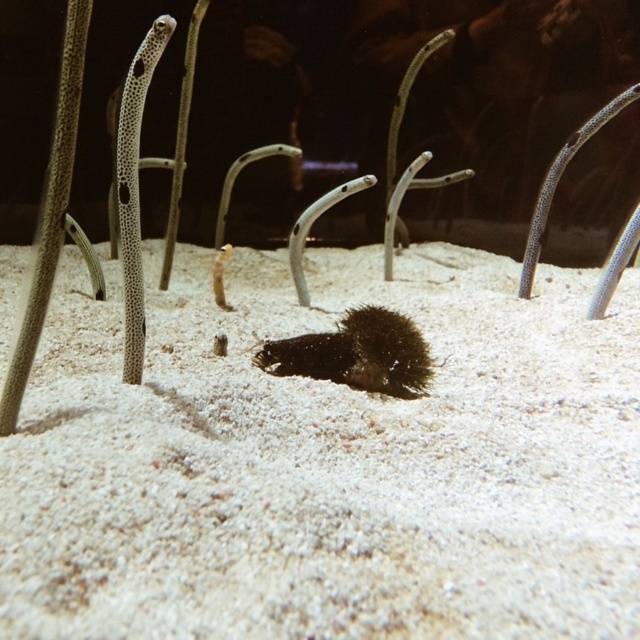
Is dark fuzzy sea urchin at center to the left of speckled skin garden eel at left from the viewer's perspective?

No, dark fuzzy sea urchin at center is not to the left of speckled skin garden eel at left.

Is point (380, 353) closer to viewer compared to point (132, 336)?

No, it is behind (132, 336).

Locate an element on the screen. dark fuzzy sea urchin at center is located at coordinates (356, 353).

Based on the photo, does white sandy bottom at center appear under dark fuzzy sea urchin at center?

Actually, white sandy bottom at center is above dark fuzzy sea urchin at center.

Does white sandy bottom at center appear on the left side of dark fuzzy sea urchin at center?

In fact, white sandy bottom at center is to the right of dark fuzzy sea urchin at center.

Locate an element on the screen. The height and width of the screenshot is (640, 640). white sandy bottom at center is located at coordinates (326, 461).

Who is lower down, white sandy bottom at center or speckled skin garden eel at left?

Positioned lower is white sandy bottom at center.

Who is taller, white sandy bottom at center or speckled skin garden eel at left?

Standing taller between the two is white sandy bottom at center.

I want to click on white sandy bottom at center, so click(326, 461).